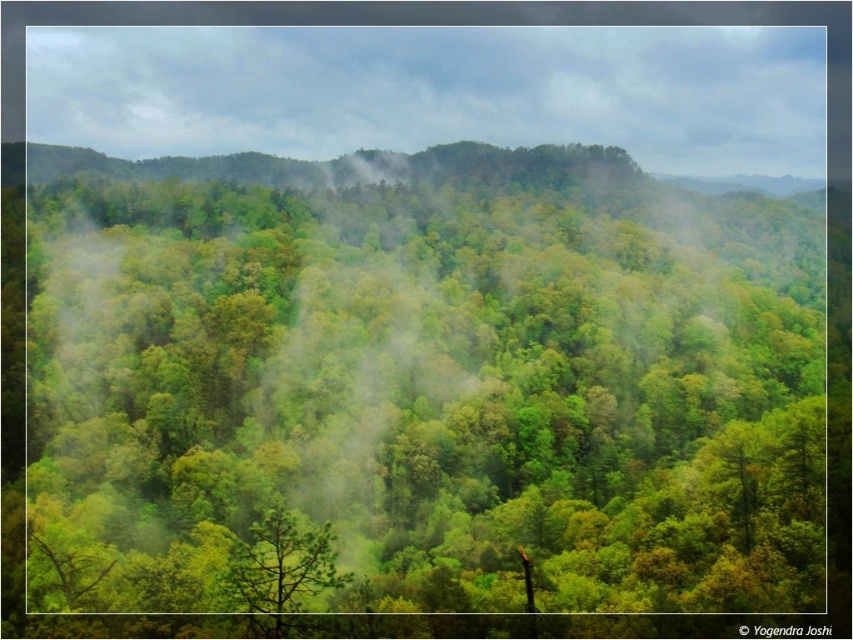
Question: Can you confirm if green misty forest at upper center is positioned below green matte tree at center?

Choices:
 (A) no
 (B) yes

Answer: (A)

Question: Which of these objects is positioned closest to the green matte tree at center?

Choices:
 (A) green misty forest at upper center
 (B) green leafy tree at center

Answer: (B)

Question: Which object is the farthest from the green leafy tree at center?

Choices:
 (A) green matte tree at center
 (B) green misty forest at upper center

Answer: (B)

Question: Can you confirm if green leafy tree at center is positioned below green matte tree at center?

Choices:
 (A) no
 (B) yes

Answer: (A)

Question: Estimate the real-world distances between objects in this image. Which object is farther from the green misty forest at upper center?

Choices:
 (A) green matte tree at center
 (B) green leafy tree at center

Answer: (A)

Question: Considering the relative positions of green leafy tree at center and green misty forest at upper center in the image provided, where is green leafy tree at center located with respect to green misty forest at upper center?

Choices:
 (A) below
 (B) above

Answer: (A)